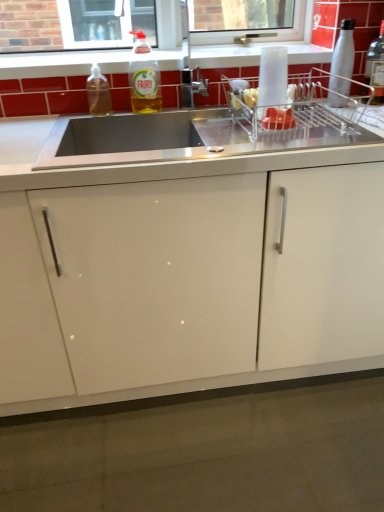
Question: Does clear glass bottle at upper right, acting as the 4th bottle starting from the left, come behind stainless steel sink at center?

Choices:
 (A) no
 (B) yes

Answer: (B)

Question: Is clear glass bottle at upper right, which appears as the 1th bottle when viewed from the right, wider than stainless steel sink at center?

Choices:
 (A) yes
 (B) no

Answer: (B)

Question: From the image's perspective, is clear glass bottle at upper right, acting as the 4th bottle starting from the left, on stainless steel sink at center?

Choices:
 (A) no
 (B) yes

Answer: (B)

Question: Is stainless steel sink at center completely or partially inside clear glass bottle at upper right, which appears as the 1th bottle when viewed from the right?

Choices:
 (A) no
 (B) yes

Answer: (A)

Question: Would you consider clear glass bottle at upper right, which appears as the 1th bottle when viewed from the right, to be distant from stainless steel sink at center?

Choices:
 (A) yes
 (B) no

Answer: (B)

Question: Would you say clear glass bottle at upper right, which appears as the 1th bottle when viewed from the right, is to the left or to the right of white glossy window sill at upper center in the picture?

Choices:
 (A) left
 (B) right

Answer: (B)

Question: Is point (372, 69) closer or farther from the camera than point (284, 42)?

Choices:
 (A) closer
 (B) farther

Answer: (A)

Question: From the image's perspective, is clear glass bottle at upper right, acting as the 4th bottle starting from the left, above or below white glossy window sill at upper center?

Choices:
 (A) above
 (B) below

Answer: (A)

Question: From a real-world perspective, relative to white glossy window sill at upper center, is clear glass bottle at upper right, which appears as the 1th bottle when viewed from the right, vertically above or below?

Choices:
 (A) above
 (B) below

Answer: (A)

Question: Considering the positions of metallic silver dish rack at upper right and translucent plastic soap dispenser at upper left, arranged as the 1th bottle when viewed from the left, in the image, is metallic silver dish rack at upper right taller or shorter than translucent plastic soap dispenser at upper left, arranged as the 1th bottle when viewed from the left,?

Choices:
 (A) tall
 (B) short

Answer: (B)

Question: Is metallic silver dish rack at upper right wider or thinner than translucent plastic soap dispenser at upper left, arranged as the 1th bottle when viewed from the left?

Choices:
 (A) wide
 (B) thin

Answer: (A)

Question: Would you say metallic silver dish rack at upper right is to the left or to the right of translucent plastic soap dispenser at upper left, which appears as the 4th bottle when viewed from the right, in the picture?

Choices:
 (A) left
 (B) right

Answer: (B)

Question: From a real-world perspective, is metallic silver dish rack at upper right physically located above or below translucent plastic soap dispenser at upper left, which appears as the 4th bottle when viewed from the right?

Choices:
 (A) below
 (B) above

Answer: (A)

Question: From the image's perspective, relative to stainless steel sink at center, is translucent plastic bottle at upper center, marked as the 2th bottle in a left-to-right arrangement, above or below?

Choices:
 (A) above
 (B) below

Answer: (B)

Question: Considering the positions of translucent plastic bottle at upper center, which is the 3th bottle from right to left, and stainless steel sink at center in the image, is translucent plastic bottle at upper center, which is the 3th bottle from right to left, wider or thinner than stainless steel sink at center?

Choices:
 (A) wide
 (B) thin

Answer: (A)